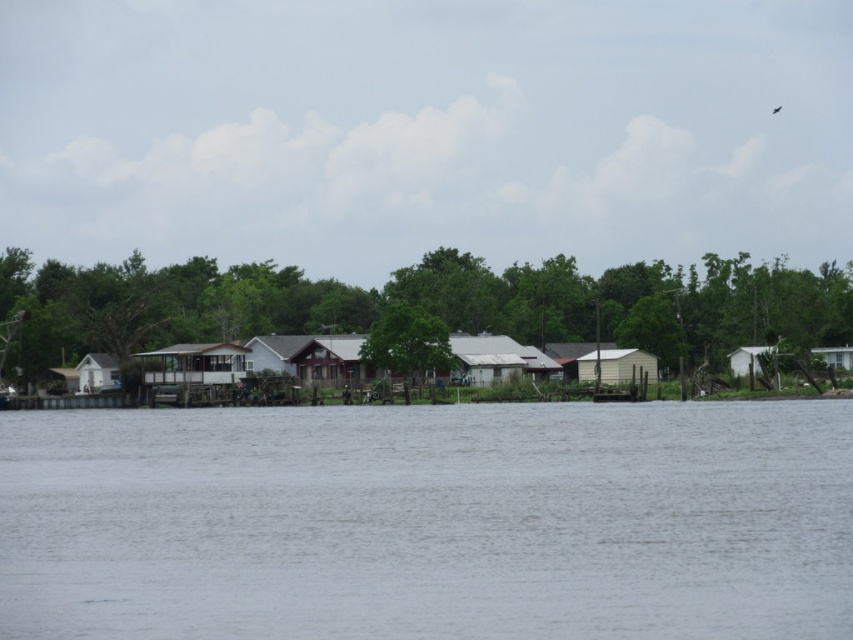
You are standing at the riverside and want to reach a specific point marked as point [590,364]. Given that the distance from your current position to this point is 343.45 feet, can you estimate how far you need to walk to reach it?

The distance between your current position and point [590,364] is 343.45 feet, so you need to walk approximately 343.45 feet to reach it.